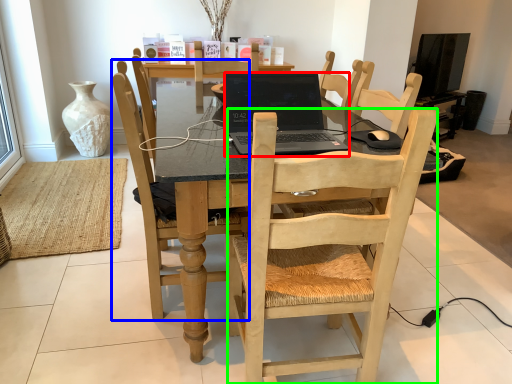
Question: Based on their relative distances, which object is nearer to laptop (highlighted by a red box)? Choose from chair (highlighted by a blue box) and chair (highlighted by a green box).

Choices:
 (A) chair
 (B) chair

Answer: (A)